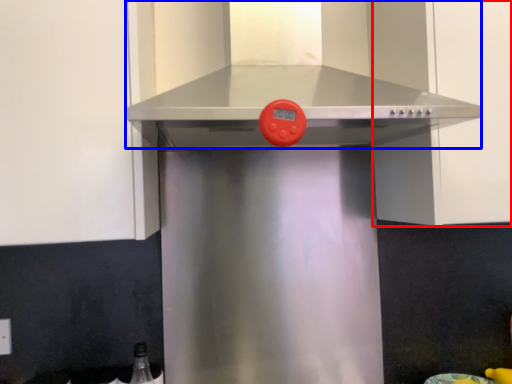
Question: Which object is further to the camera taking this photo, cabinetry (highlighted by a red box) or vent (highlighted by a blue box)?

Choices:
 (A) cabinetry
 (B) vent

Answer: (A)